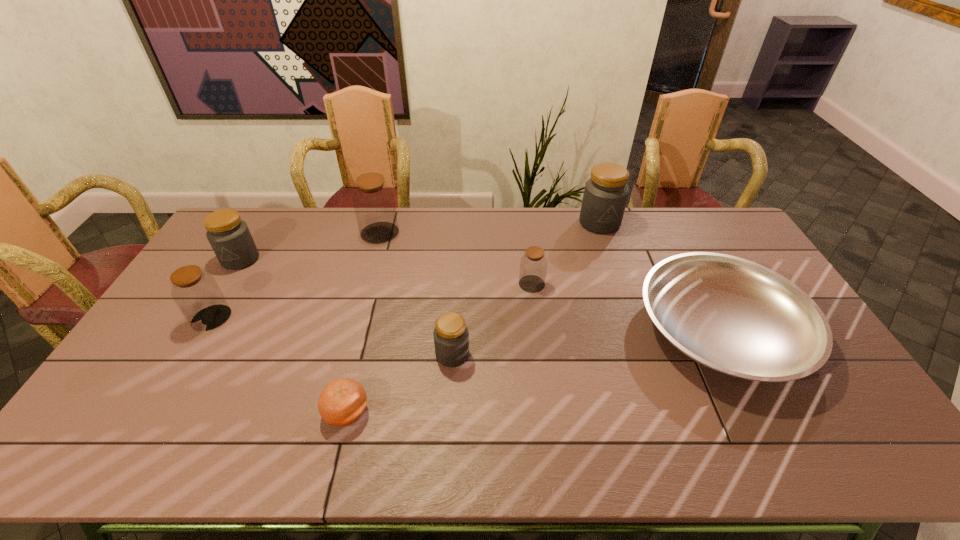
Where is `vacant space situated 0.370m on the left of the bedpan`? vacant space situated 0.370m on the left of the bedpan is located at coordinates (512, 330).

Identify the location of vacant area situated on the left of the clementine. (272, 412).

At what (x,y) coordinates should I click in order to perform the action: click on object located at the near edge. Please return your answer as a coordinate pair (x, y). The image size is (960, 540). Looking at the image, I should click on (341, 403).

The height and width of the screenshot is (540, 960). I want to click on object that is at the right edge, so click(x=734, y=316).

Identify the location of vacant space at the far edge of the desktop. The width and height of the screenshot is (960, 540). (545, 209).

In the image, there is a desktop. Identify the location of vacant space at the near edge. The height and width of the screenshot is (540, 960). (202, 454).

You are a GUI agent. You are given a task and a screenshot of the screen. Output one action in this format:
    pyautogui.click(x=<x>, y=<y>)
    Task: Click on the vacant space at the left edge of the desktop
    This screenshot has height=540, width=960.
    Given the screenshot: What is the action you would take?
    pyautogui.click(x=168, y=374)

What are the coordinates of `vacant space at the right edge of the desktop` in the screenshot? It's located at (824, 401).

You are a GUI agent. You are given a task and a screenshot of the screen. Output one action in this format:
    pyautogui.click(x=<x>, y=<y>)
    Task: Click on the vacant region at the near left corner of the desktop
    This screenshot has width=960, height=540.
    Given the screenshot: What is the action you would take?
    pyautogui.click(x=77, y=460)

This screenshot has height=540, width=960. Identify the location of vacant region between the second brown jar from left to right and the smallest gray jar. (416, 294).